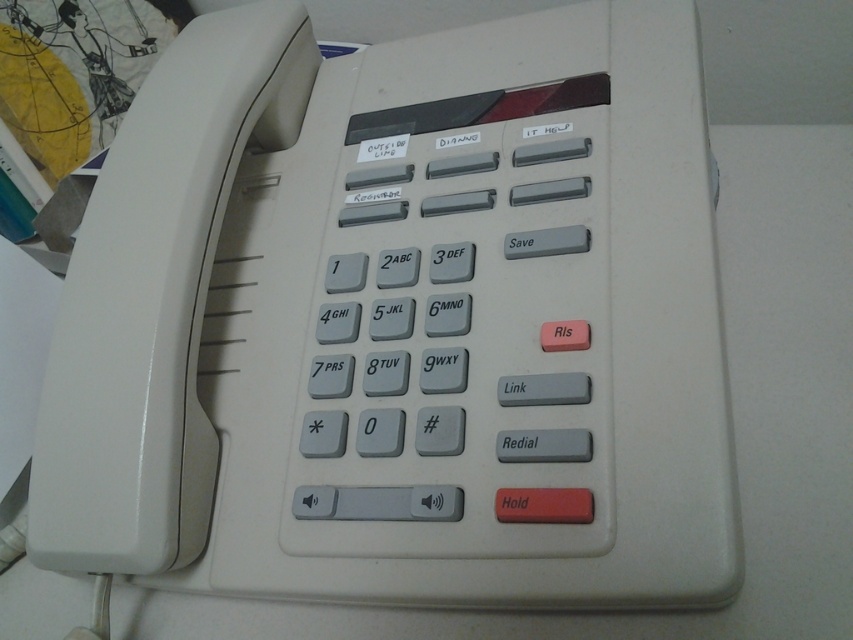
Is matte red button at center positioned behind matte gray key at center?

No.

Consider the image. Who is taller, matte red button at center or matte gray key at center?

With more height is matte gray key at center.

The width and height of the screenshot is (853, 640). What are the coordinates of `matte red button at center` in the screenshot? It's located at (543, 504).

You are a GUI agent. You are given a task and a screenshot of the screen. Output one action in this format:
    pyautogui.click(x=<x>, y=<y>)
    Task: Click on the matte red button at center
    Image resolution: width=853 pixels, height=640 pixels.
    Given the screenshot: What is the action you would take?
    pyautogui.click(x=543, y=504)